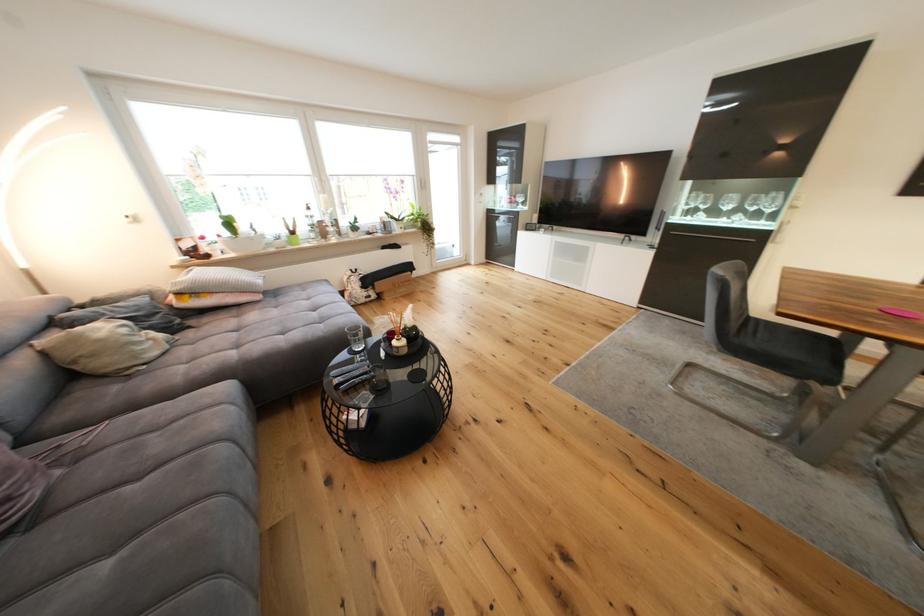
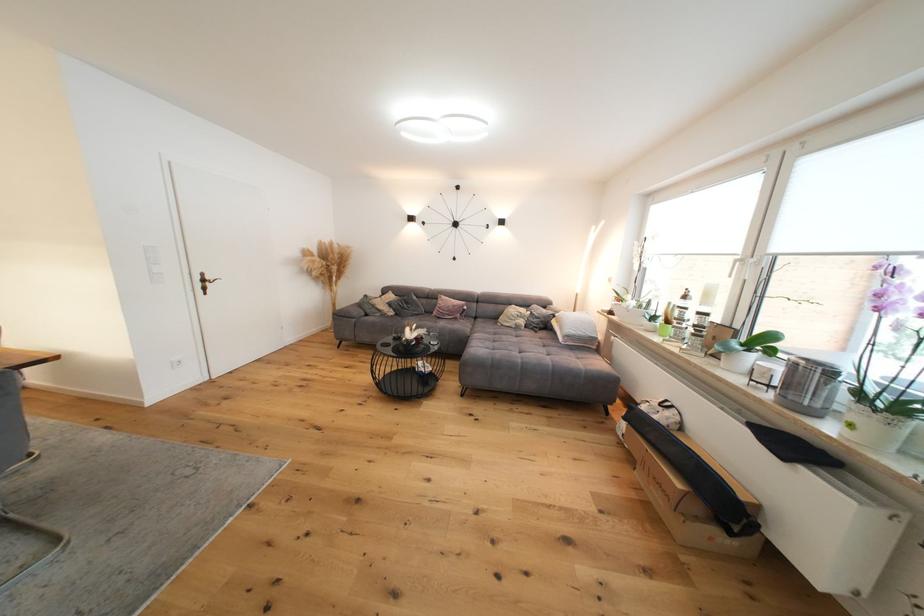
Locate, in the second image, the point that corresponds to point 178,345 in the first image.

(524, 330)